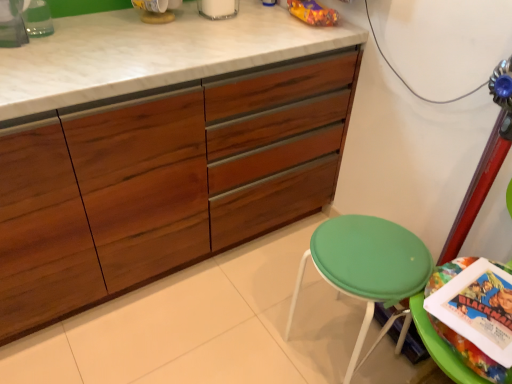
Question: From a real-world perspective, is wooden cabinet at center positioned over green fabric stool at lower right based on gravity?

Choices:
 (A) yes
 (B) no

Answer: (A)

Question: Is wooden cabinet at center located outside green fabric stool at lower right?

Choices:
 (A) no
 (B) yes

Answer: (B)

Question: Can you confirm if wooden cabinet at center is positioned to the right of green fabric stool at lower right?

Choices:
 (A) yes
 (B) no

Answer: (B)

Question: Considering the relative sizes of wooden cabinet at center and green fabric stool at lower right in the image provided, is wooden cabinet at center smaller than green fabric stool at lower right?

Choices:
 (A) yes
 (B) no

Answer: (B)

Question: Can you confirm if wooden cabinet at center is shorter than green fabric stool at lower right?

Choices:
 (A) no
 (B) yes

Answer: (A)

Question: Is wooden cabinet at center to the left of green fabric stool at lower right from the viewer's perspective?

Choices:
 (A) yes
 (B) no

Answer: (A)

Question: From the image's perspective, is wooden cabinet at center on green plastic stool at lower right?

Choices:
 (A) no
 (B) yes

Answer: (B)

Question: Does wooden cabinet at center have a lesser height compared to green plastic stool at lower right?

Choices:
 (A) yes
 (B) no

Answer: (B)

Question: Considering the relative positions of wooden cabinet at center and green plastic stool at lower right in the image provided, is wooden cabinet at center behind green plastic stool at lower right?

Choices:
 (A) yes
 (B) no

Answer: (B)

Question: Is wooden cabinet at center far from green plastic stool at lower right?

Choices:
 (A) yes
 (B) no

Answer: (B)

Question: Is wooden cabinet at center wider than green plastic stool at lower right?

Choices:
 (A) no
 (B) yes

Answer: (B)

Question: Does wooden cabinet at center have a smaller size compared to green plastic stool at lower right?

Choices:
 (A) yes
 (B) no

Answer: (B)

Question: Can you confirm if green plastic stool at lower right is shorter than wooden cabinet at center?

Choices:
 (A) yes
 (B) no

Answer: (A)